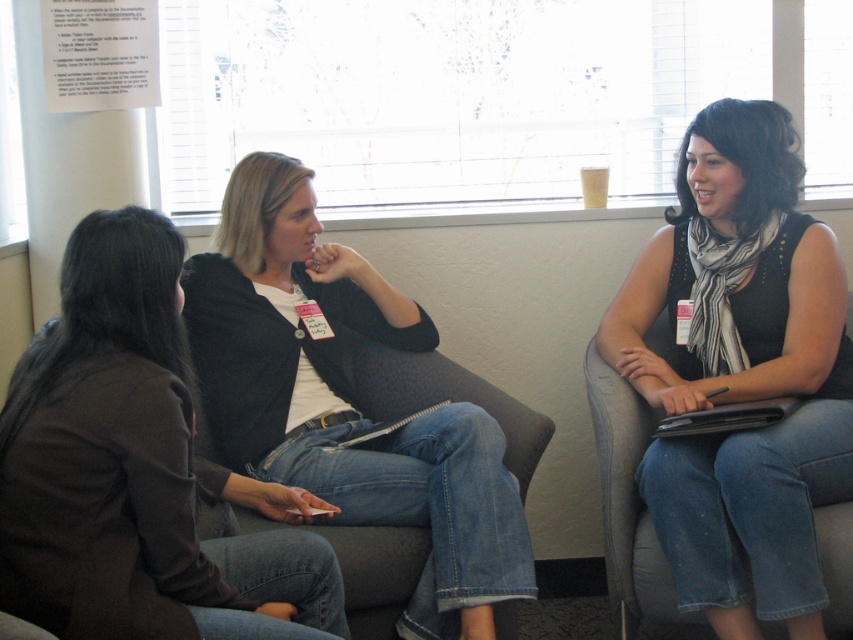
Question: Is matte black jacket at center to the left of denim jeans at center from the viewer's perspective?

Choices:
 (A) no
 (B) yes

Answer: (B)

Question: Is matte black jacket at center wider than denim jeans at center?

Choices:
 (A) yes
 (B) no

Answer: (B)

Question: Which object appears farthest from the camera in this image?

Choices:
 (A) matte black jacket at center
 (B) black matte scarf at center

Answer: (B)

Question: Estimate the real-world distances between objects in this image. Which object is closer to the black matte scarf at center?

Choices:
 (A) denim jeans at center
 (B) matte black jacket at center

Answer: (A)

Question: Which point is farther to the camera?

Choices:
 (A) (86, 584)
 (B) (433, 634)

Answer: (B)

Question: Does matte black jacket at center have a lesser width compared to denim jeans at center?

Choices:
 (A) no
 (B) yes

Answer: (B)